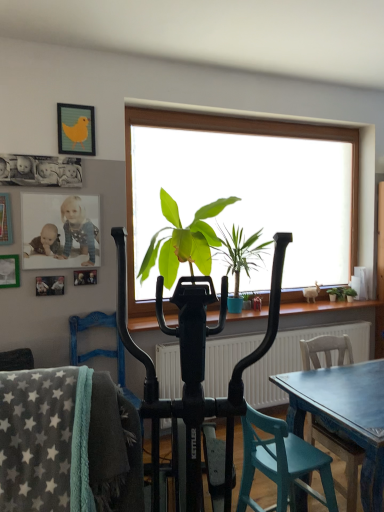
Question: Which direction should I rotate to look at green leafy plant at center, positioned as the 3th houseplant in right-to-left order?

Choices:
 (A) right
 (B) left

Answer: (B)

Question: Does green leafy plant at right, the 1th houseplant from the right, have a lesser width compared to green leafy plant at center, the first houseplant in the left-to-right sequence?

Choices:
 (A) yes
 (B) no

Answer: (A)

Question: Is green leafy plant at right, which is counted as the 3th houseplant, starting from the left, with green leafy plant at center, positioned as the 3th houseplant in right-to-left order?

Choices:
 (A) yes
 (B) no

Answer: (B)

Question: Can you confirm if green leafy plant at right, the 1th houseplant from the right, is positioned to the left of green leafy plant at center, positioned as the 3th houseplant in right-to-left order?

Choices:
 (A) yes
 (B) no

Answer: (B)

Question: Does green leafy plant at right, which is counted as the 3th houseplant, starting from the left, have a greater height compared to green leafy plant at center, the first houseplant in the left-to-right sequence?

Choices:
 (A) no
 (B) yes

Answer: (A)

Question: From a real-world perspective, is green leafy plant at right, which is counted as the 3th houseplant, starting from the left, over green leafy plant at center, positioned as the 3th houseplant in right-to-left order?

Choices:
 (A) no
 (B) yes

Answer: (A)

Question: Does green leafy plant at right, which is counted as the 3th houseplant, starting from the left, appear on the right side of green leafy plant at center, positioned as the 3th houseplant in right-to-left order?

Choices:
 (A) yes
 (B) no

Answer: (A)

Question: Can you confirm if green leafy plant at center, positioned as the 3th houseplant in right-to-left order, is positioned to the right of wooden chair at lower right, which is the 1th chair from back to front?

Choices:
 (A) no
 (B) yes

Answer: (A)

Question: From a real-world perspective, does green leafy plant at center, positioned as the 3th houseplant in right-to-left order, stand above wooden chair at lower right, which is the 1th chair from back to front?

Choices:
 (A) no
 (B) yes

Answer: (B)

Question: Can you confirm if green leafy plant at center, positioned as the 3th houseplant in right-to-left order, is positioned to the left of wooden chair at lower right, the first chair in the right-to-left sequence?

Choices:
 (A) no
 (B) yes

Answer: (B)

Question: From a real-world perspective, is green leafy plant at center, positioned as the 3th houseplant in right-to-left order, located beneath wooden chair at lower right, the first chair in the right-to-left sequence?

Choices:
 (A) yes
 (B) no

Answer: (B)

Question: From the image's perspective, is green leafy plant at center, the first houseplant in the left-to-right sequence, on top of wooden chair at lower right, which is the 1th chair from back to front?

Choices:
 (A) no
 (B) yes

Answer: (B)

Question: Is the depth of green leafy plant at center, positioned as the 3th houseplant in right-to-left order, greater than that of wooden chair at lower right, which is the 1th chair from back to front?

Choices:
 (A) yes
 (B) no

Answer: (A)

Question: Can you confirm if matte plastic photo frame at upper left, which ranks as the second picture frame in bottom-to-top order, is taller than wooden chair at lower right, arranged as the third chair when viewed from the left?

Choices:
 (A) no
 (B) yes

Answer: (A)